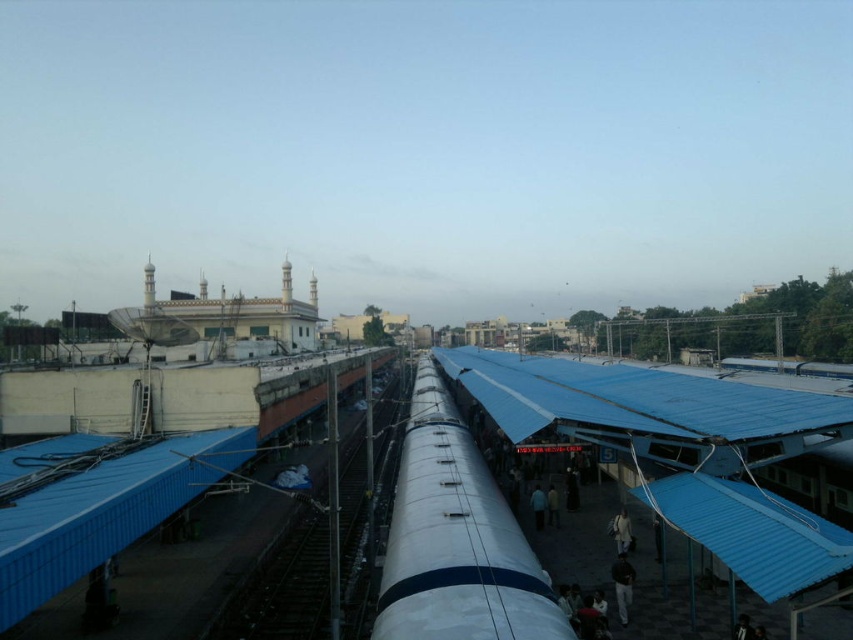
You are standing on the platform and want to board the silver metallic train at center. There is a person wearing a light brown fabric jacket at lower right blocking your path. Can you walk around them to reach the train?

The silver metallic train at center is closer to the viewer than the light brown fabric jacket at lower right, so you can walk around the person wearing the light brown fabric jacket at lower right to reach the train.

You are a maintenance worker checking the platform. You notice the smooth metal train track at center and the dark blue fabric at center. Which object is higher in height?

The smooth metal train track at center is much taller than the dark blue fabric at center.

You are a maintenance worker on the train platform. You need to access the smooth metal train track at center to inspect it. However, there is a dark blue fabric at center above it. Can you reach the track without moving the fabric?

The smooth metal train track at center is below the dark blue fabric at center, so you can reach the track without needing to move the fabric.